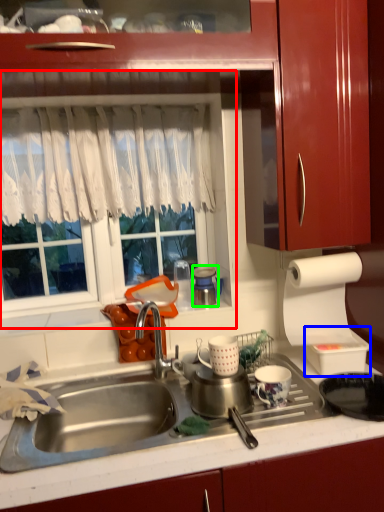
Question: Considering the real-world distances, which object is farthest from window screen (highlighted by a red box)? appliance (highlighted by a blue box) or appliance (highlighted by a green box)?

Choices:
 (A) appliance
 (B) appliance

Answer: (A)